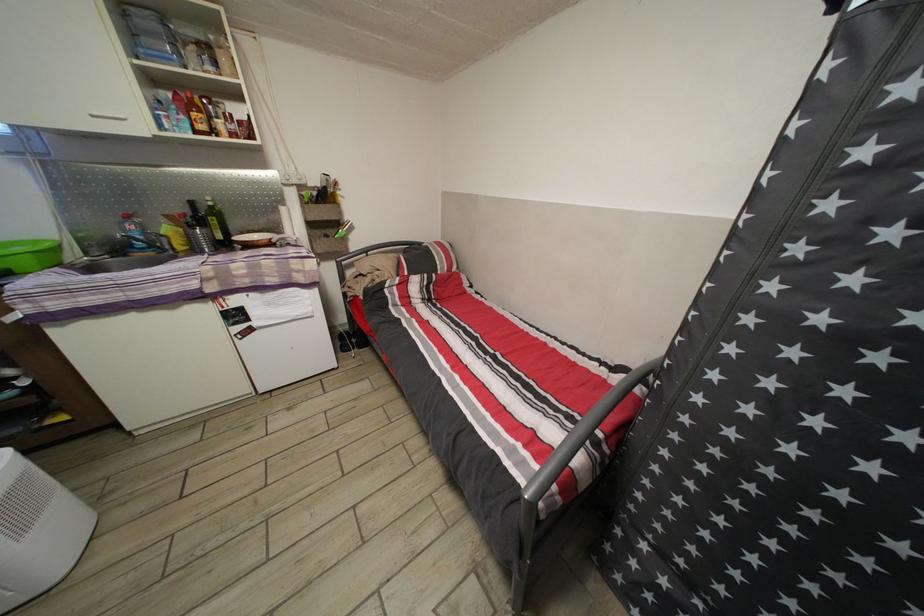
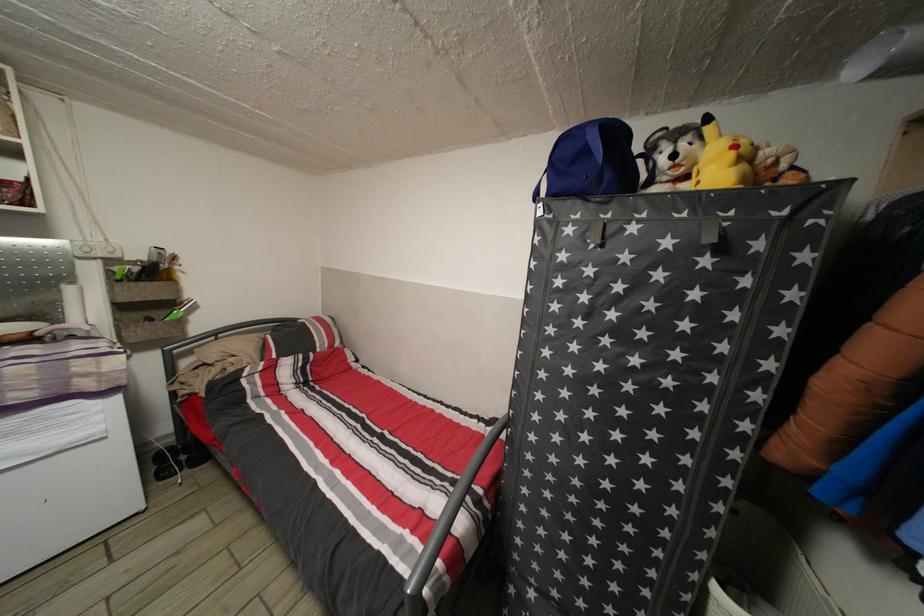
Locate, in the second image, the point that corresponds to pixel 354 339 in the first image.

(177, 455)